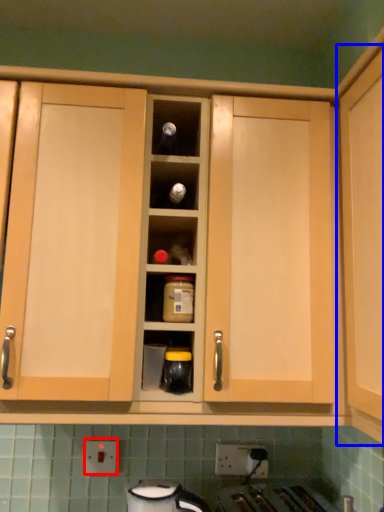
Question: Which of the following is the farthest to the observer, electric outlet (highlighted by a red box) or cabinetry (highlighted by a blue box)?

Choices:
 (A) electric outlet
 (B) cabinetry

Answer: (A)